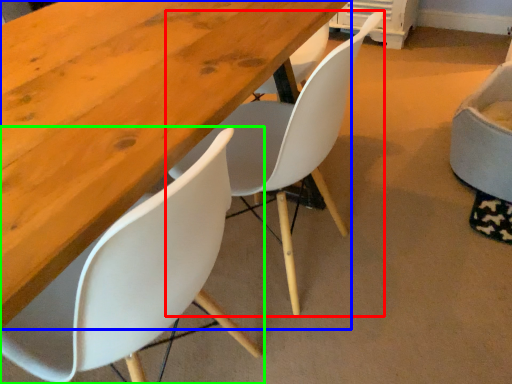
Question: Based on their relative distances, which object is farther from chair (highlighted by a red box)? Choose from table (highlighted by a blue box) and chair (highlighted by a green box).

Choices:
 (A) table
 (B) chair

Answer: (B)